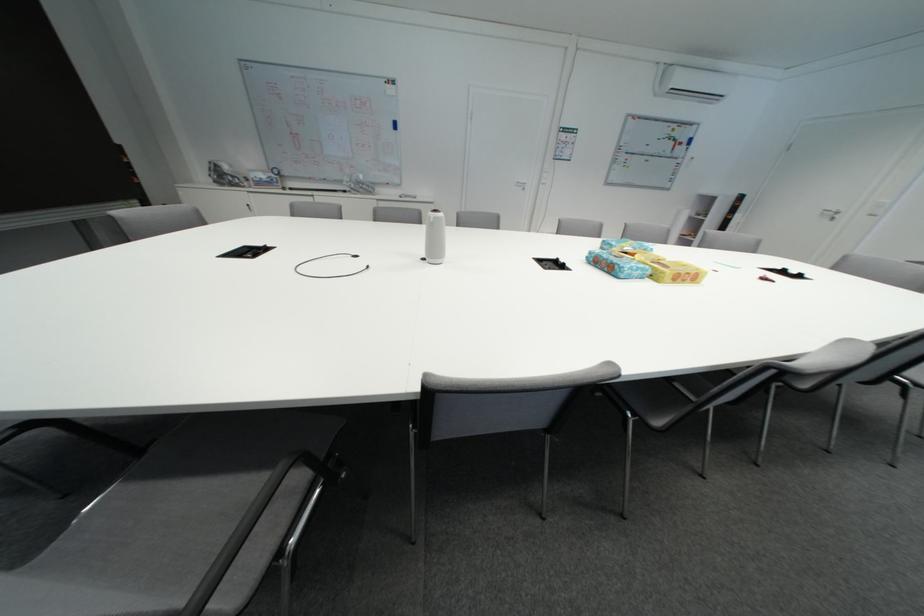
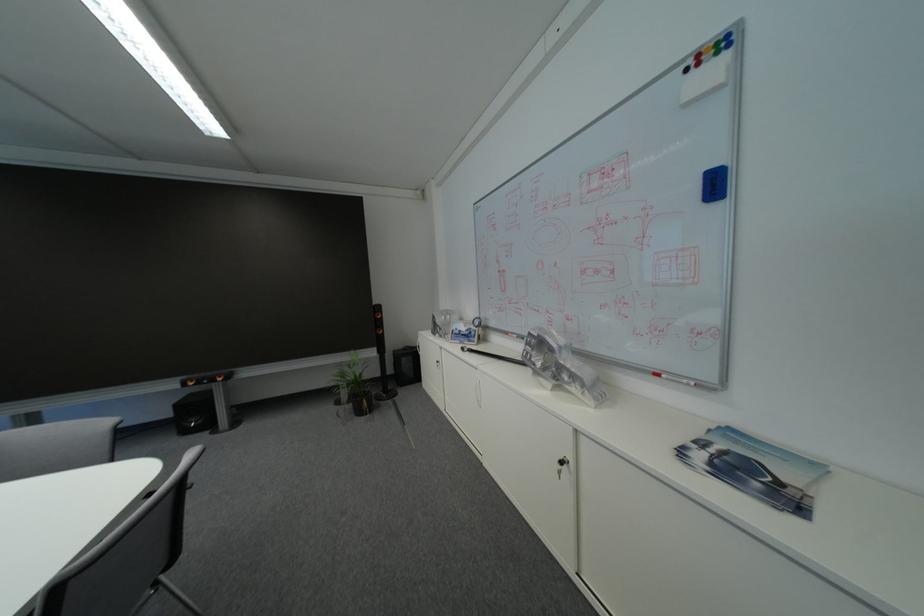
Where in the second image is the point corresponding to point (400, 79) from the first image?

(723, 34)